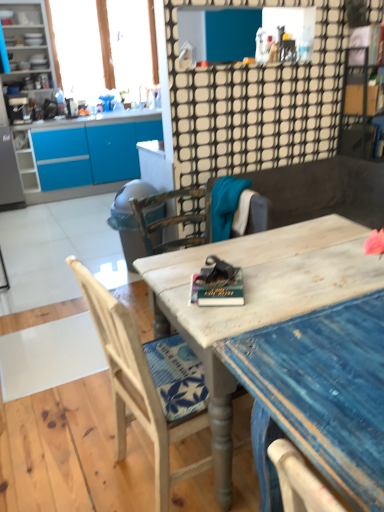
Question: Can you see matte gray trash can at center-left touching matte white cabinet at upper left?

Choices:
 (A) no
 (B) yes

Answer: (A)

Question: From a real-world perspective, is matte gray trash can at center-left physically below matte white cabinet at upper left?

Choices:
 (A) no
 (B) yes

Answer: (B)

Question: Does matte gray trash can at center-left have a smaller size compared to matte white cabinet at upper left?

Choices:
 (A) no
 (B) yes

Answer: (B)

Question: Is matte gray trash can at center-left shorter than matte white cabinet at upper left?

Choices:
 (A) yes
 (B) no

Answer: (A)

Question: Is matte gray trash can at center-left in front of matte white cabinet at upper left?

Choices:
 (A) no
 (B) yes

Answer: (B)

Question: From a real-world perspective, is wooden chair at center, the 1th chair from the back, above or below matte white cabinet at upper left?

Choices:
 (A) above
 (B) below

Answer: (B)

Question: From the image's perspective, is wooden chair at center, the 1th chair from the back, positioned above or below matte white cabinet at upper left?

Choices:
 (A) below
 (B) above

Answer: (A)

Question: Considering the positions of wooden chair at center, the 1th chair from the back, and matte white cabinet at upper left in the image, is wooden chair at center, the 1th chair from the back, bigger or smaller than matte white cabinet at upper left?

Choices:
 (A) big
 (B) small

Answer: (B)

Question: From their relative heights in the image, would you say wooden chair at center, the 1th chair from the back, is taller or shorter than matte white cabinet at upper left?

Choices:
 (A) short
 (B) tall

Answer: (A)

Question: From a real-world perspective, relative to wooden chair at center, the 2th chair positioned from the back, is wooden chair at center vertically above or below?

Choices:
 (A) above
 (B) below

Answer: (B)

Question: Is point (337, 186) closer or farther from the camera than point (109, 317)?

Choices:
 (A) farther
 (B) closer

Answer: (A)

Question: From their relative heights in the image, would you say wooden chair at center is taller or shorter than wooden chair at center, the 2th chair positioned from the back?

Choices:
 (A) short
 (B) tall

Answer: (A)

Question: Visually, is wooden chair at center positioned to the left or to the right of wooden chair at center, marked as the 1th chair in a front-to-back arrangement?

Choices:
 (A) right
 (B) left

Answer: (A)

Question: From the image's perspective, is wooden chair at center, the 2th chair positioned from the back, located above or below translucent fabric at upper left?

Choices:
 (A) below
 (B) above

Answer: (A)

Question: Is point (158, 501) closer or farther from the camera than point (107, 46)?

Choices:
 (A) closer
 (B) farther

Answer: (A)